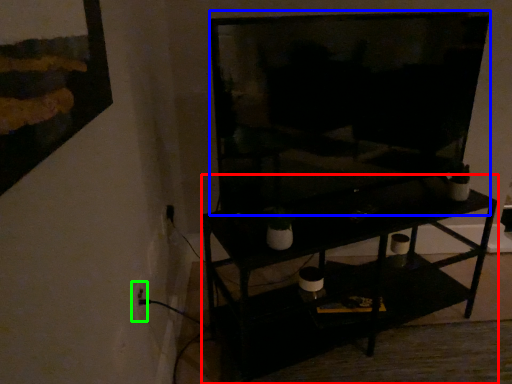
Question: Which is farther away from shelf (highlighted by a red box)? television (highlighted by a blue box) or electric outlet (highlighted by a green box)?

Choices:
 (A) television
 (B) electric outlet

Answer: (B)